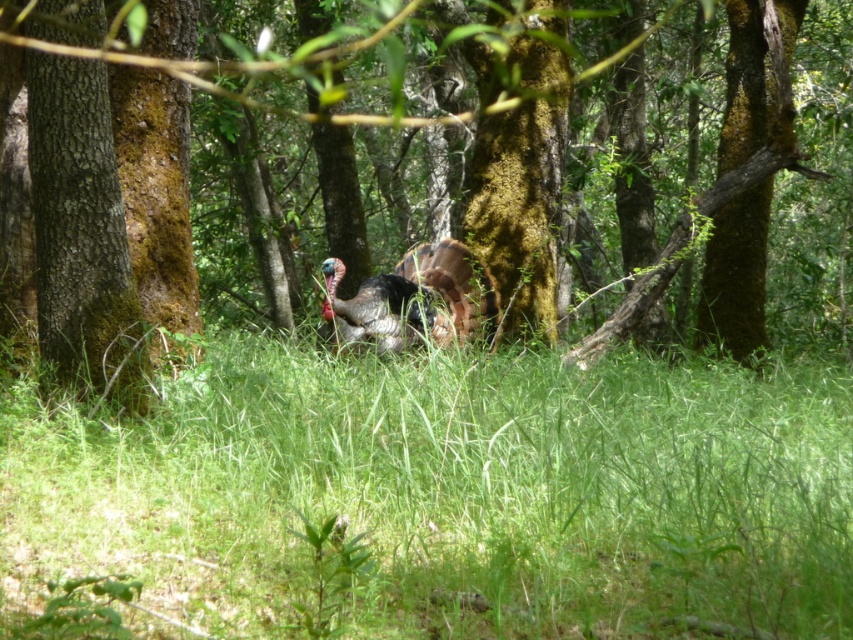
Can you confirm if green grassy at center is positioned to the right of shiny black turkey at center?

Yes, green grassy at center is to the right of shiny black turkey at center.

Who is taller, green grassy at center or shiny black turkey at center?

shiny black turkey at center

Is point (366, 602) positioned behind point (415, 307)?

That is False.

In order to click on green grassy at center in this screenshot , I will do `click(450, 493)`.

Who is lower down, shiny black turkey at center or brown mossy tree at center?

shiny black turkey at center is below.

Can you confirm if shiny black turkey at center is positioned to the left of brown mossy tree at center?

Yes, shiny black turkey at center is to the left of brown mossy tree at center.

Locate an element on the screen. This screenshot has height=640, width=853. shiny black turkey at center is located at coordinates (415, 300).

Is green grassy at center wider than brown mossy tree at center?

In fact, green grassy at center might be narrower than brown mossy tree at center.

From the picture: Between green grassy at center and brown mossy tree at center, which one has less height?

Standing shorter between the two is green grassy at center.

Does point (639, 492) lie behind point (142, 44)?

No, it is in front of (142, 44).

The width and height of the screenshot is (853, 640). Identify the location of green grassy at center. (450, 493).